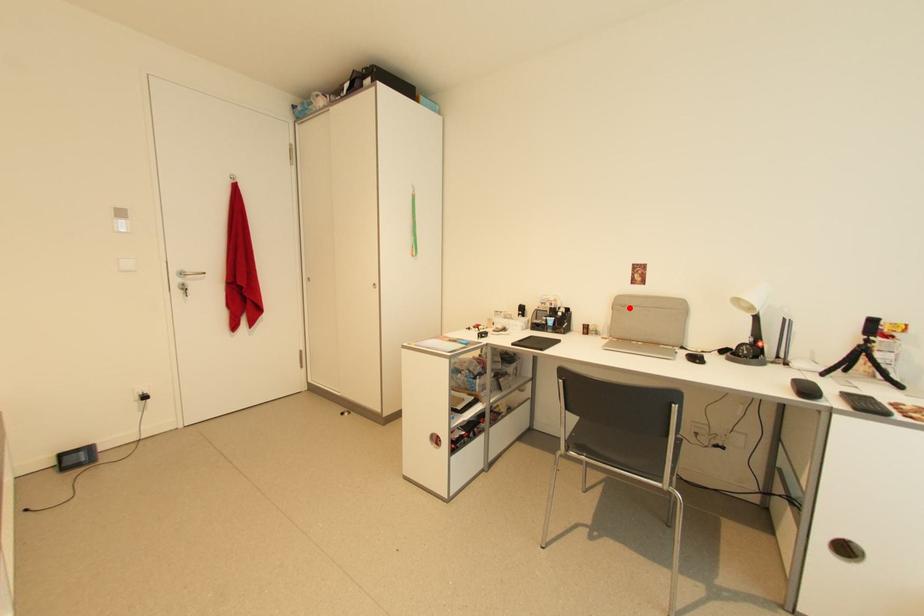
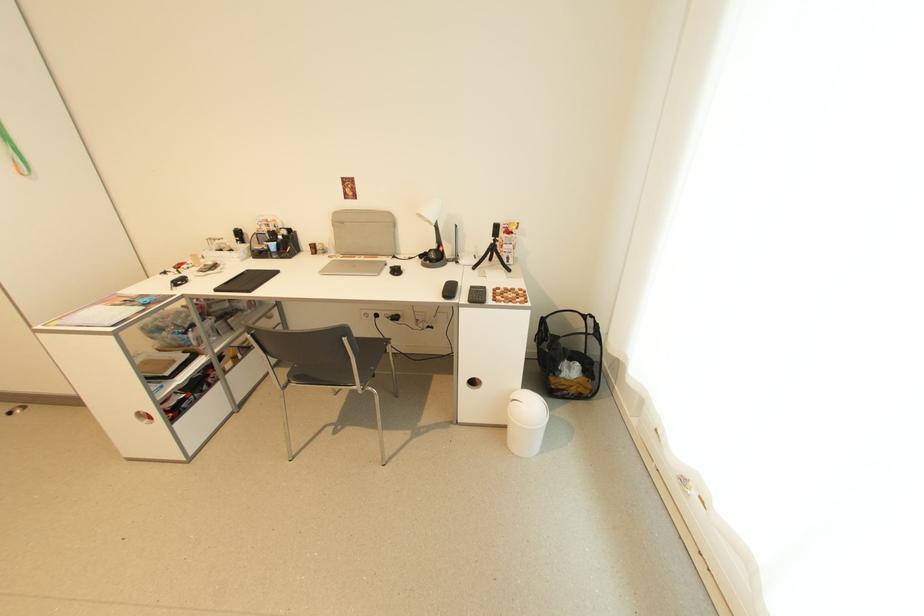
Question: A red point is marked in image1. In image2, is the corresponding 3D point closer to the camera or farther? Reply with the corresponding letter.

Choices:
 (A) The corresponding 3D point is closer.
 (B) The corresponding 3D point is farther.

Answer: (A)